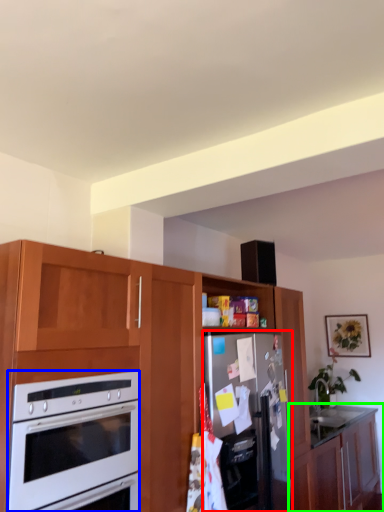
Question: Based on their relative distances, which object is nearer to refrigerator (highlighted by a red box)? Choose from oven (highlighted by a blue box) and cabinetry (highlighted by a green box).

Choices:
 (A) oven
 (B) cabinetry

Answer: (A)